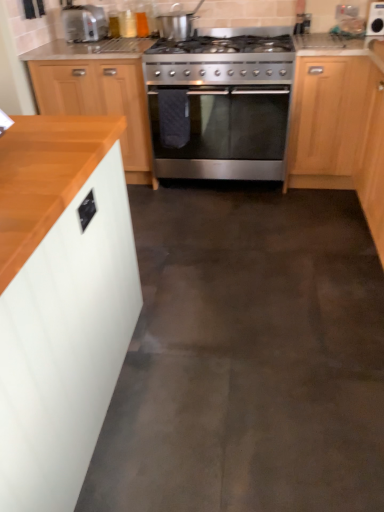
Question: Which direction should I rotate to face satin silver pot at upper center, which ranks as the first appliance in left-to-right order, — up or down?

Choices:
 (A) up
 (B) down

Answer: (A)

Question: Should I look upward or downward to see stainless steel gas stove at center?

Choices:
 (A) up
 (B) down

Answer: (A)

Question: From a real-world perspective, is white glossy microwave at upper right, which ranks as the 2th appliance in left-to-right order, physically above light wood cabinet at right, placed as the 1th cabinetry when sorted from right to left?

Choices:
 (A) yes
 (B) no

Answer: (A)

Question: Does white glossy microwave at upper right, which is counted as the 1th appliance, starting from the right, have a larger size compared to light wood cabinet at right, positioned as the third cabinetry in left-to-right order?

Choices:
 (A) yes
 (B) no

Answer: (B)

Question: Does white glossy microwave at upper right, which is counted as the 1th appliance, starting from the right, have a greater width compared to light wood cabinet at right, positioned as the third cabinetry in left-to-right order?

Choices:
 (A) yes
 (B) no

Answer: (B)

Question: Is white glossy microwave at upper right, which ranks as the 2th appliance in left-to-right order, positioned far away from light wood cabinet at right, the 2th cabinetry in the front-to-back sequence?

Choices:
 (A) yes
 (B) no

Answer: (B)

Question: Is white glossy microwave at upper right, which ranks as the 2th appliance in left-to-right order, aimed at light wood cabinet at right, which is the 2th cabinetry in back-to-front order?

Choices:
 (A) no
 (B) yes

Answer: (A)

Question: Does white glossy microwave at upper right, which is counted as the 1th appliance, starting from the right, come behind light wood cabinet at right, positioned as the third cabinetry in left-to-right order?

Choices:
 (A) no
 (B) yes

Answer: (B)

Question: Is light wood cabinet at right, positioned as the third cabinetry in left-to-right order, shorter than stainless steel oven at center?

Choices:
 (A) yes
 (B) no

Answer: (B)

Question: Does light wood cabinet at right, which is the 2th cabinetry in back-to-front order, lie behind stainless steel oven at center?

Choices:
 (A) no
 (B) yes

Answer: (A)

Question: Can you see light wood cabinet at right, the 2th cabinetry in the front-to-back sequence, touching stainless steel oven at center?

Choices:
 (A) no
 (B) yes

Answer: (A)

Question: Considering the relative positions of light wood cabinet at right, placed as the 1th cabinetry when sorted from right to left, and stainless steel oven at center in the image provided, is light wood cabinet at right, placed as the 1th cabinetry when sorted from right to left, to the right of stainless steel oven at center from the viewer's perspective?

Choices:
 (A) no
 (B) yes

Answer: (B)

Question: Can you confirm if light wood cabinet at right, placed as the 1th cabinetry when sorted from right to left, is thinner than stainless steel oven at center?

Choices:
 (A) yes
 (B) no

Answer: (A)

Question: Is light wood cabinet at right, positioned as the third cabinetry in left-to-right order, oriented away from stainless steel oven at center?

Choices:
 (A) yes
 (B) no

Answer: (B)

Question: Is stainless steel gas stove at center with matte silver toaster at upper left?

Choices:
 (A) yes
 (B) no

Answer: (B)